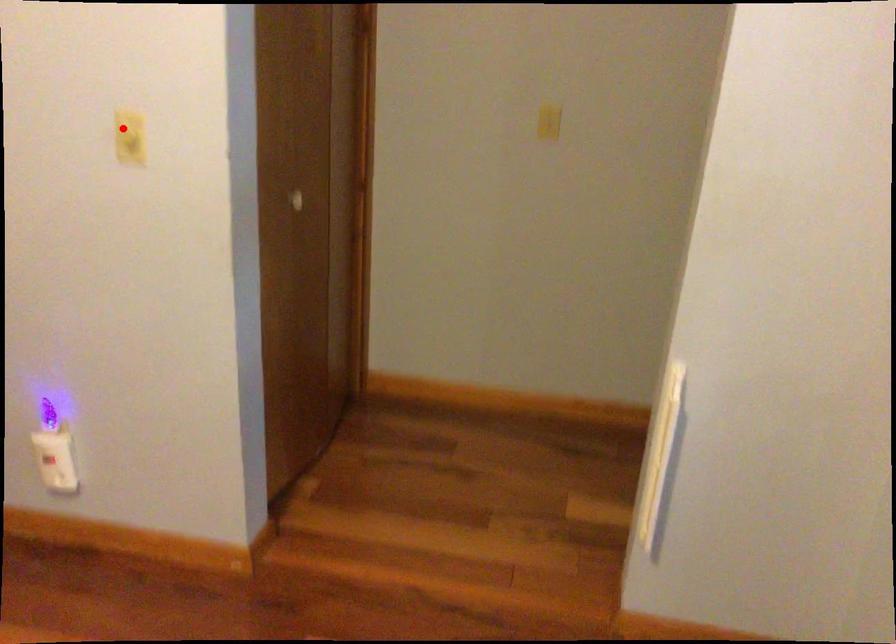
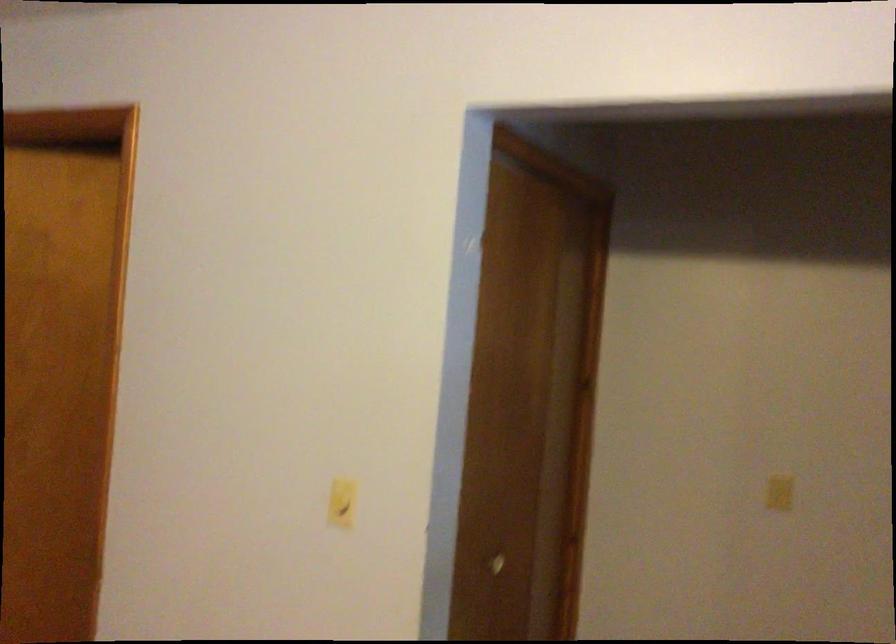
Question: I am providing you with two images of the same scene from different viewpoints. A red point is marked on the first image. Can you still see the location of the red point in image 2?

Choices:
 (A) Yes
 (B) No

Answer: (A)